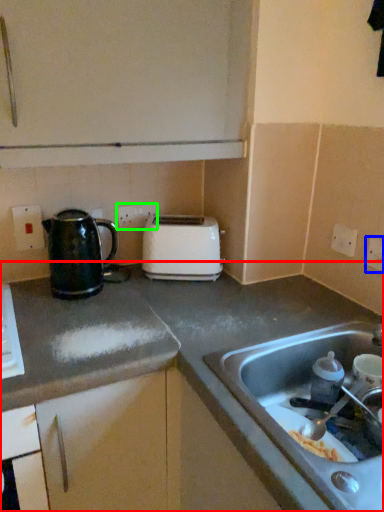
Question: Which object is positioned farthest from countertop (highlighted by a red box)? Select from electric outlet (highlighted by a blue box) and electric outlet (highlighted by a green box).

Choices:
 (A) electric outlet
 (B) electric outlet

Answer: (A)